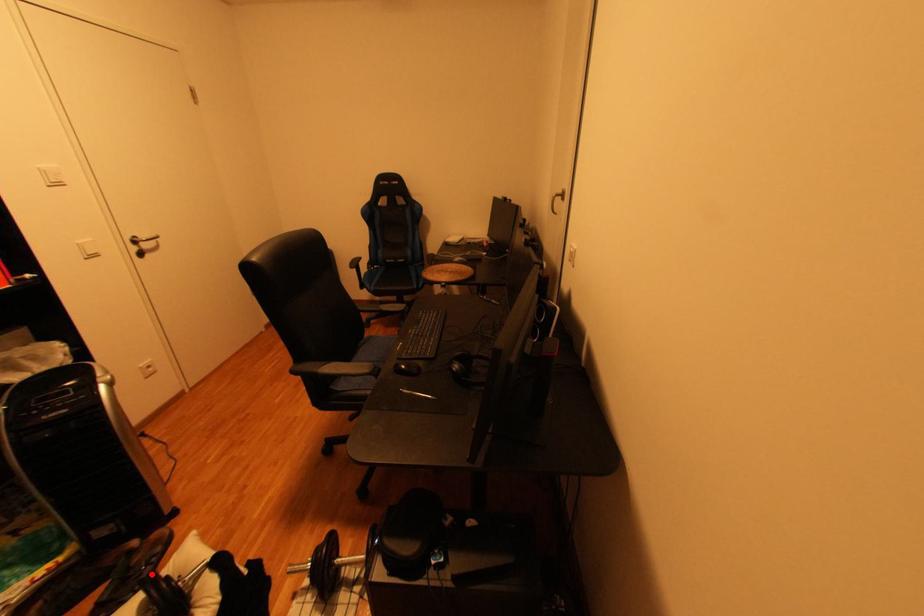
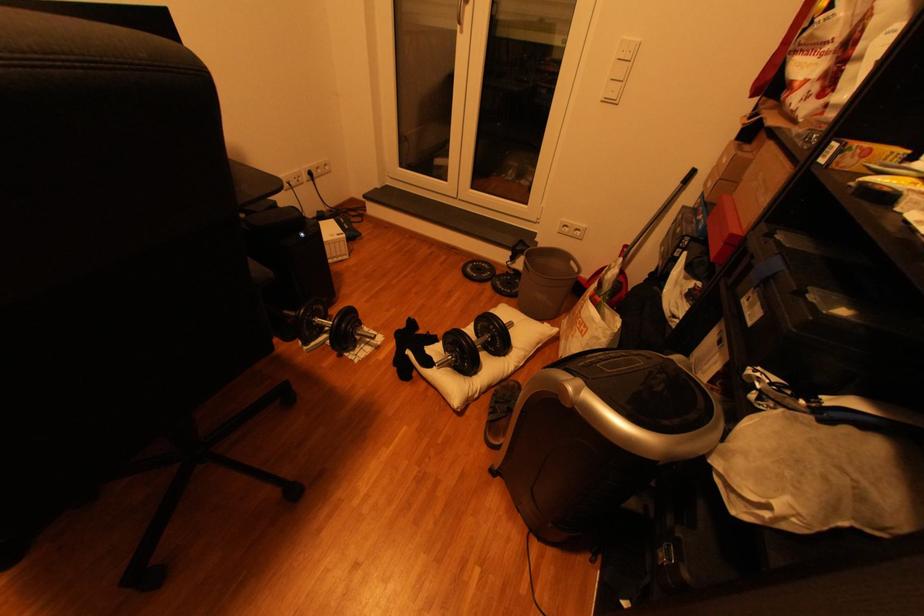
Question: A red point is marked in image1. In image2, is the corresponding 3D point closer to the camera or farther? Reply with the corresponding letter.

Choices:
 (A) The corresponding 3D point is closer.
 (B) The corresponding 3D point is farther.

Answer: (A)